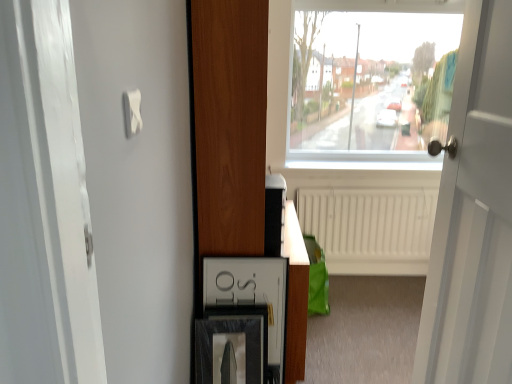
You are a GUI agent. You are given a task and a screenshot of the screen. Output one action in this format:
    pyautogui.click(x=<x>, y=<y>)
    Task: Click on the free space in front of white matte radiator at center
    
    Given the screenshot: What is the action you would take?
    pyautogui.click(x=370, y=317)